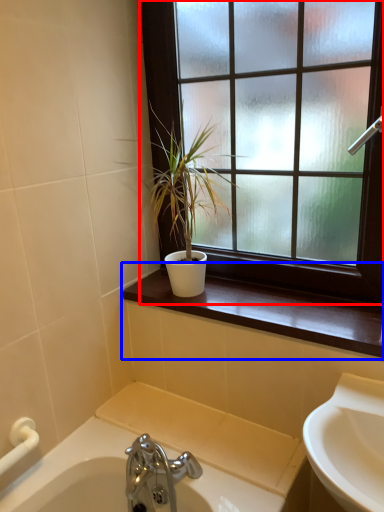
Question: Which object appears farthest to the camera in this image, window (highlighted by a red box) or window sill (highlighted by a blue box)?

Choices:
 (A) window
 (B) window sill

Answer: (B)